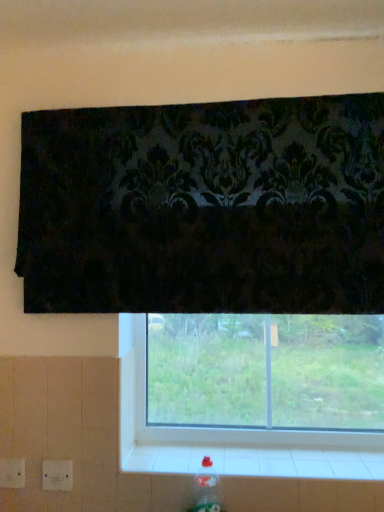
Question: From the image's perspective, would you say clear plastic bottle at lower right is shown under white tile at lower center?

Choices:
 (A) no
 (B) yes

Answer: (B)

Question: Would you say clear plastic bottle at lower right is outside white tile at lower center?

Choices:
 (A) yes
 (B) no

Answer: (A)

Question: Would you consider clear plastic bottle at lower right to be distant from white tile at lower center?

Choices:
 (A) no
 (B) yes

Answer: (A)

Question: Can you confirm if clear plastic bottle at lower right is shorter than white tile at lower center?

Choices:
 (A) yes
 (B) no

Answer: (B)

Question: Considering the relative positions of clear plastic bottle at lower right and white tile at lower center in the image provided, is clear plastic bottle at lower right in front of white tile at lower center?

Choices:
 (A) yes
 (B) no

Answer: (A)

Question: Is clear plastic bottle at lower right positioned behind white tile at lower center?

Choices:
 (A) yes
 (B) no

Answer: (B)

Question: Is white tile at lower center at the back of transparent glass window at center?

Choices:
 (A) no
 (B) yes

Answer: (A)

Question: From a real-world perspective, is transparent glass window at center below white tile at lower center?

Choices:
 (A) no
 (B) yes

Answer: (A)

Question: From the image's perspective, is transparent glass window at center under white tile at lower center?

Choices:
 (A) yes
 (B) no

Answer: (B)

Question: Does transparent glass window at center have a greater width compared to white tile at lower center?

Choices:
 (A) no
 (B) yes

Answer: (A)

Question: Does transparent glass window at center have a larger size compared to white tile at lower center?

Choices:
 (A) yes
 (B) no

Answer: (A)

Question: Is transparent glass window at center further to camera compared to white tile at lower center?

Choices:
 (A) no
 (B) yes

Answer: (B)

Question: Considering the relative positions of clear plastic bottle at lower right and transparent glass window at center in the image provided, is clear plastic bottle at lower right to the right of transparent glass window at center from the viewer's perspective?

Choices:
 (A) no
 (B) yes

Answer: (A)